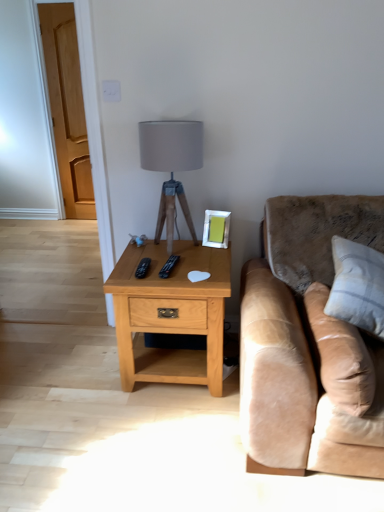
Locate an element on the screen. The width and height of the screenshot is (384, 512). free point in front of matte gray fabric lampshade at center is located at coordinates (181, 269).